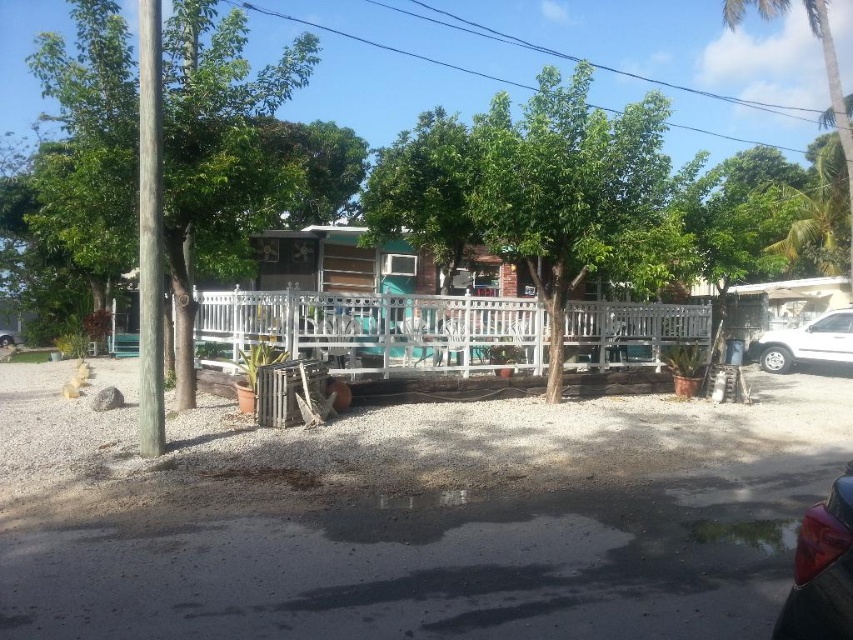
Who is taller, green leafy tree at center or white matte suv at right?

green leafy tree at center

Is green leafy tree at center to the right of white matte suv at right from the viewer's perspective?

Incorrect, green leafy tree at center is not on the right side of white matte suv at right.

Identify the location of green leafy tree at center. The image size is (853, 640). 540,195.

Where is `green leafy tree at center`? The image size is (853, 640). green leafy tree at center is located at coordinates (540, 195).

Between green leafy tree at center and green leafy tree at left, which one appears on the right side from the viewer's perspective?

From the viewer's perspective, green leafy tree at center appears more on the right side.

Does green leafy tree at center come behind green leafy tree at left?

Yes, it is.

Where is `green leafy tree at center`? This screenshot has width=853, height=640. green leafy tree at center is located at coordinates (540, 195).

Does glossy plastic car at lower right have a lesser width compared to white matte suv at right?

Indeed, glossy plastic car at lower right has a lesser width compared to white matte suv at right.

Does glossy plastic car at lower right have a larger size compared to white matte suv at right?

No, glossy plastic car at lower right is not bigger than white matte suv at right.

Is point (828, 515) positioned behind point (799, 340)?

No, (828, 515) is in front of (799, 340).

This screenshot has width=853, height=640. Identify the location of glossy plastic car at lower right. 821,570.